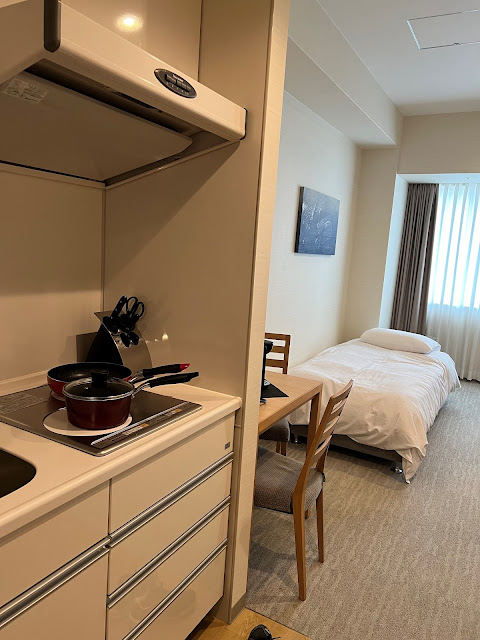
Locate an element on the screen. This screenshot has height=640, width=480. extractor fan is located at coordinates (67, 139).